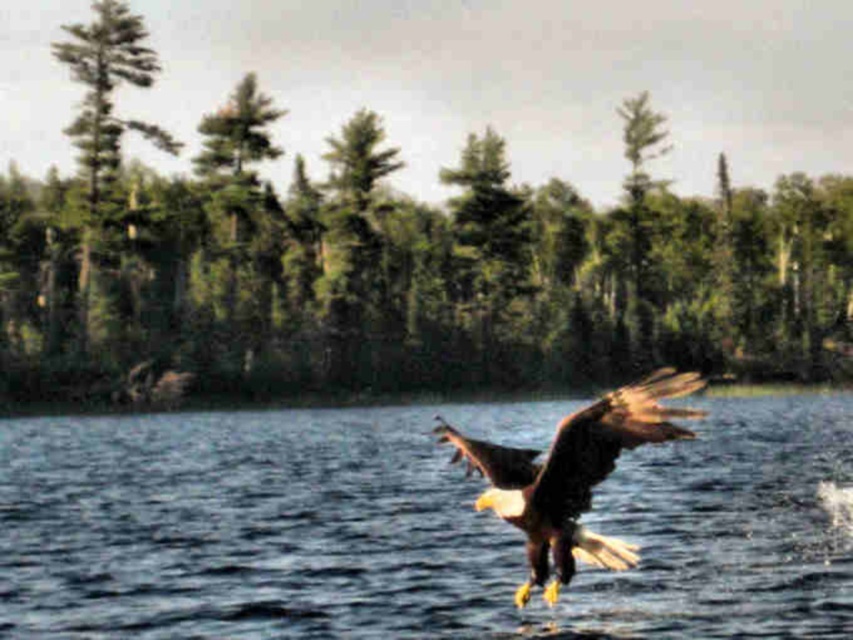
Question: Can you confirm if green textured tree at center is positioned to the right of green textured tree at upper left?

Choices:
 (A) no
 (B) yes

Answer: (B)

Question: Can you confirm if blue water at center is smaller than green textured tree at upper left?

Choices:
 (A) yes
 (B) no

Answer: (A)

Question: Which point is closer to the camera?

Choices:
 (A) (399, 499)
 (B) (682, 417)
 (C) (149, 140)

Answer: (B)

Question: Which object is farther from the camera taking this photo?

Choices:
 (A) green textured tree at center
 (B) brown feathered eagle at center
 (C) blue water at center

Answer: (A)

Question: Considering the relative positions of blue water at center and brown feathered eagle at center in the image provided, where is blue water at center located with respect to brown feathered eagle at center?

Choices:
 (A) right
 (B) left

Answer: (B)

Question: Which object appears farthest from the camera in this image?

Choices:
 (A) brown feathered eagle at center
 (B) green textured tree at center
 (C) green textured tree at upper left
 (D) blue water at center

Answer: (C)